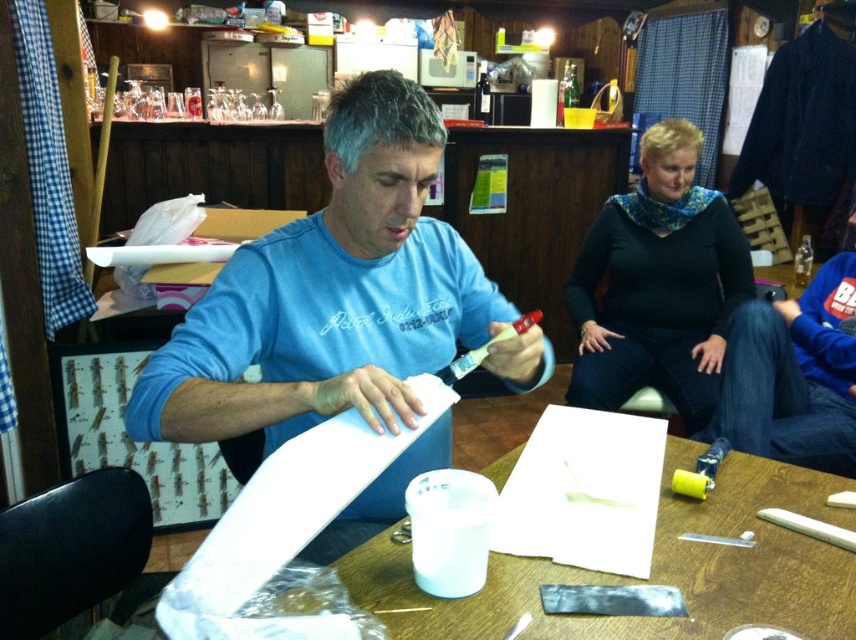
Which of these two, blue matte shirt at center or black matte sweater at upper right, stands taller?

With more height is black matte sweater at upper right.

Can you confirm if blue matte shirt at center is taller than black matte sweater at upper right?

In fact, blue matte shirt at center may be shorter than black matte sweater at upper right.

This screenshot has height=640, width=856. In order to click on blue matte shirt at center in this screenshot , I will do `click(330, 294)`.

Between white paperboard at center and black matte sweater at upper right, which one has more height?

black matte sweater at upper right

Which is in front, point (450, 625) or point (625, 224)?

Point (450, 625)

This screenshot has height=640, width=856. What do you see at coordinates (651, 568) in the screenshot?
I see `white paperboard at center` at bounding box center [651, 568].

You are a GUI agent. You are given a task and a screenshot of the screen. Output one action in this format:
    pyautogui.click(x=<x>, y=<y>)
    Task: Click on the white paperboard at center
    Image resolution: width=856 pixels, height=640 pixels.
    Given the screenshot: What is the action you would take?
    pyautogui.click(x=651, y=568)

Is point (349, 314) closer to viewer compared to point (486, 580)?

No, (349, 314) is behind (486, 580).

Is blue matte shirt at center shorter than white paperboard at center?

In fact, blue matte shirt at center may be taller than white paperboard at center.

The width and height of the screenshot is (856, 640). What do you see at coordinates (330, 294) in the screenshot?
I see `blue matte shirt at center` at bounding box center [330, 294].

Locate an element on the screen. This screenshot has width=856, height=640. blue matte shirt at center is located at coordinates (330, 294).